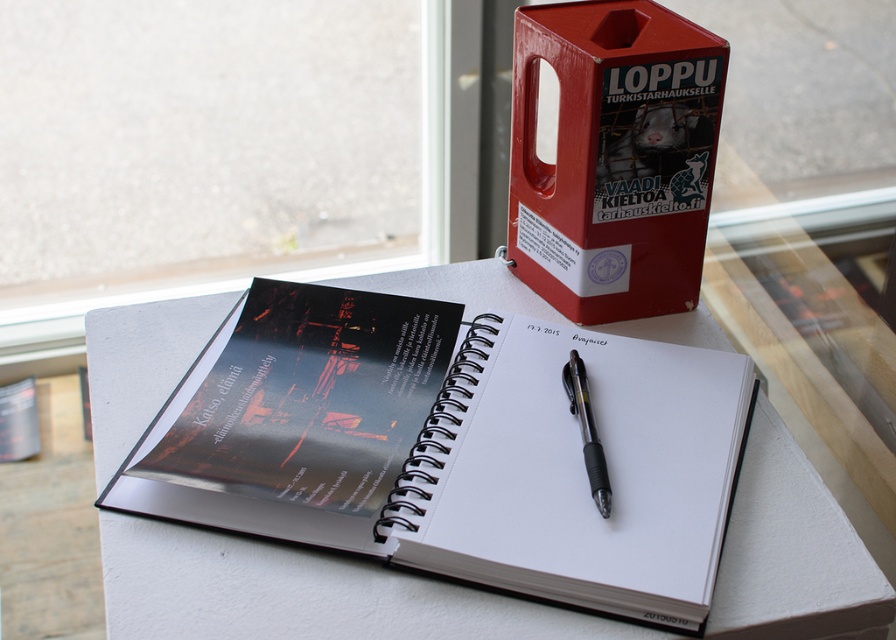
In the scene shown: You are organizing your desk and need to know which object is taller between the black matte notebook at center and the red plastic box at upper right. Which one is taller?

The red plastic box at upper right is taller than the black matte notebook at center.

You are a photographer aiming to capture a closeup of the notebook and pen. You notice two points in the scene at coordinates point (269, 422) and point (602, 452). Which point should you focus on to ensure the notebook is in sharp focus?

You should focus on point (269, 422) because it is closer to the camera than point (602, 452), ensuring the notebook remains in sharp focus.

You are organizing your desk and need to place a new item between the black matte notebook at center and the red plastic box at upper right. Based on their positions, where should you place the new item?

The black matte notebook at center is below the red plastic box at upper right, so you should place the new item in the space between them, above the notebook and below the box.